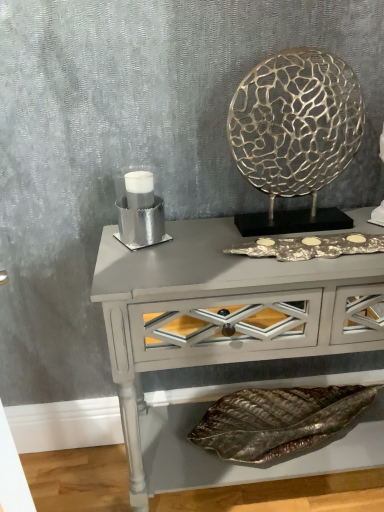
Measure the distance between point (333, 61) and camera.

Point (333, 61) and camera are 86.20 centimeters apart from each other.

Identify the location of silver metallic candle holder at left. This screenshot has height=512, width=384. (139, 209).

What do you see at coordinates (277, 420) in the screenshot? This screenshot has height=512, width=384. I see `metallic leaf at lower center` at bounding box center [277, 420].

Find the location of a particular element. The image size is (384, 512). gold textured metal at upper right is located at coordinates (295, 135).

Is gold textured metal at upper right wider or thinner than matte gray console table at center?

gold textured metal at upper right is thinner than matte gray console table at center.

Does gold textured metal at upper right come in front of matte gray console table at center?

No, gold textured metal at upper right is further to the viewer.

Between gold textured metal at upper right and matte gray console table at center, which one appears on the right side from the viewer's perspective?

gold textured metal at upper right is more to the right.

Is metallic leaf at lower center not within silver metallic candle holder at left?

Indeed, metallic leaf at lower center is completely outside silver metallic candle holder at left.

From a real-world perspective, does metallic leaf at lower center stand above silver metallic candle holder at left?

No, from a real-world perspective, metallic leaf at lower center is not above silver metallic candle holder at left.

From the image's perspective, is metallic leaf at lower center located above or below silver metallic candle holder at left?

From the image's perspective, metallic leaf at lower center appears below silver metallic candle holder at left.

Between metallic leaf at lower center and silver metallic candle holder at left, which one appears on the left side from the viewer's perspective?

Positioned to the left is silver metallic candle holder at left.

From a real-world perspective, which object rests below the other?

matte gray console table at center is physically lower.

Does silver metallic candle holder at left have a lesser height compared to matte gray console table at center?

Yes, silver metallic candle holder at left is shorter than matte gray console table at center.

Is silver metallic candle holder at left far from matte gray console table at center?

No, silver metallic candle holder at left is in close proximity to matte gray console table at center.

From the image's perspective, would you say silver metallic candle holder at left is positioned over matte gray console table at center?

Yes, from the image's perspective, silver metallic candle holder at left is over matte gray console table at center.

Between matte gray console table at center and metallic leaf at lower center, which one appears on the left side from the viewer's perspective?

Positioned to the left is matte gray console table at center.

Based on the photo, is matte gray console table at center positioned with its back to metallic leaf at lower center?

Absolutely, matte gray console table at center is directed away from metallic leaf at lower center.

Is matte gray console table at center bigger or smaller than metallic leaf at lower center?

Considering their sizes, matte gray console table at center takes up more space than metallic leaf at lower center.

How many degrees apart are the facing directions of matte gray console table at center and metallic leaf at lower center?

matte gray console table at center and metallic leaf at lower center are facing 0.000573 degrees away from each other.

In terms of size, does matte gray console table at center appear bigger or smaller than gold textured metal at upper right?

Considering their sizes, matte gray console table at center takes up more space than gold textured metal at upper right.

Is point (311, 295) farther from camera compared to point (288, 134)?

No.

How different are the orientations of matte gray console table at center and gold textured metal at upper right in degrees?

matte gray console table at center and gold textured metal at upper right are facing 0.000495 degrees away from each other.

Identify the location of material lying behind the gold textured metal at upper right. This screenshot has height=512, width=384. (277, 420).

From the image's perspective, is metallic leaf at lower center on top of gold textured metal at upper right?

Incorrect, from the image's perspective, metallic leaf at lower center is lower than gold textured metal at upper right.

Is metallic leaf at lower center positioned beyond the bounds of gold textured metal at upper right?

→ Indeed, metallic leaf at lower center is completely outside gold textured metal at upper right.

Considering the positions of objects gold textured metal at upper right and metallic leaf at lower center in the image provided, who is behind, gold textured metal at upper right or metallic leaf at lower center?

metallic leaf at lower center.

The height and width of the screenshot is (512, 384). What are the coordinates of `round table located above the metallic leaf at lower center (from the image's perspective)` in the screenshot? It's located at (295, 135).

Considering the positions of point (327, 129) and point (340, 426), is point (327, 129) closer or farther from the camera than point (340, 426)?

Point (327, 129) appears to be closer to the viewer than point (340, 426).

Considering the relative positions of gold textured metal at upper right and metallic leaf at lower center in the image provided, is gold textured metal at upper right to the left or to the right of metallic leaf at lower center?

Based on their positions, gold textured metal at upper right is located to the left of metallic leaf at lower center.

I want to click on round table above the matte gray console table at center (from the image's perspective), so click(x=295, y=135).

In order to click on candle holder on the left of metallic leaf at lower center in this screenshot , I will do `click(139, 209)`.

Looking at the image, which one is located further to gold textured metal at upper right, matte gray console table at center or silver metallic candle holder at left?

The object further to gold textured metal at upper right is silver metallic candle holder at left.

When comparing their distances from metallic leaf at lower center, does silver metallic candle holder at left or gold textured metal at upper right seem closer?

silver metallic candle holder at left is positioned closer to the anchor metallic leaf at lower center.

From the image, which object appears to be nearer to silver metallic candle holder at left, metallic leaf at lower center or matte gray console table at center?

matte gray console table at center is closer to silver metallic candle holder at left.

Considering their positions, is matte gray console table at center positioned further to metallic leaf at lower center than gold textured metal at upper right?

The object further to metallic leaf at lower center is gold textured metal at upper right.

Estimate the real-world distances between objects in this image. Which object is closer to matte gray console table at center, metallic leaf at lower center or silver metallic candle holder at left?

Among the two, silver metallic candle holder at left is located nearer to matte gray console table at center.

When comparing their distances from gold textured metal at upper right, does silver metallic candle holder at left or metallic leaf at lower center seem further?

Based on the image, metallic leaf at lower center appears to be further to gold textured metal at upper right.

Based on their spatial positions, is gold textured metal at upper right or matte gray console table at center further from silver metallic candle holder at left?

gold textured metal at upper right is positioned further to the anchor silver metallic candle holder at left.

Looking at the image, which one is located closer to matte gray console table at center, metallic leaf at lower center or gold textured metal at upper right?

Among the two, gold textured metal at upper right is located nearer to matte gray console table at center.

I want to click on table between gold textured metal at upper right and metallic leaf at lower center vertically, so click(x=224, y=309).

This screenshot has height=512, width=384. I want to click on candle holder between gold textured metal at upper right and matte gray console table at center vertically, so click(139, 209).

Image resolution: width=384 pixels, height=512 pixels. Identify the location of table between silver metallic candle holder at left and metallic leaf at lower center from top to bottom. (224, 309).

Where is `candle holder between gold textured metal at upper right and metallic leaf at lower center in the vertical direction`? The width and height of the screenshot is (384, 512). candle holder between gold textured metal at upper right and metallic leaf at lower center in the vertical direction is located at coordinates (139, 209).